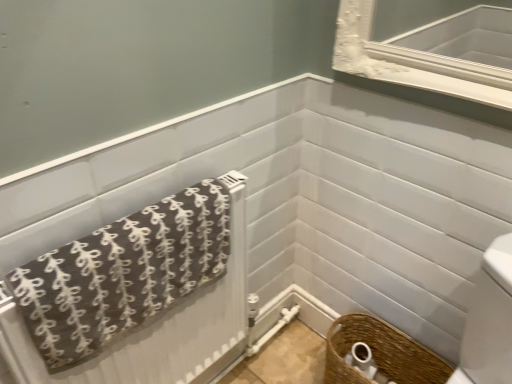
Question: Does brown fabric towel at lower left have a lesser width compared to woven brown basket at lower right?

Choices:
 (A) no
 (B) yes

Answer: (B)

Question: Does brown fabric towel at lower left appear on the right side of woven brown basket at lower right?

Choices:
 (A) yes
 (B) no

Answer: (B)

Question: Is the position of brown fabric towel at lower left less distant than that of woven brown basket at lower right?

Choices:
 (A) no
 (B) yes

Answer: (B)

Question: Considering the relative positions of brown fabric towel at lower left and woven brown basket at lower right in the image provided, is brown fabric towel at lower left to the left of woven brown basket at lower right from the viewer's perspective?

Choices:
 (A) no
 (B) yes

Answer: (B)

Question: Is brown fabric towel at lower left looking in the opposite direction of woven brown basket at lower right?

Choices:
 (A) yes
 (B) no

Answer: (B)

Question: From a real-world perspective, is brown fabric towel at lower left located beneath woven brown basket at lower right?

Choices:
 (A) yes
 (B) no

Answer: (B)

Question: From the image's perspective, would you say woven brown basket at lower right is positioned over brown fabric towel at lower left?

Choices:
 (A) yes
 (B) no

Answer: (B)

Question: From a real-world perspective, is woven brown basket at lower right positioned over brown fabric towel at lower left based on gravity?

Choices:
 (A) no
 (B) yes

Answer: (A)

Question: Is woven brown basket at lower right bigger than brown fabric towel at lower left?

Choices:
 (A) yes
 (B) no

Answer: (B)

Question: Can we say woven brown basket at lower right lies outside brown fabric towel at lower left?

Choices:
 (A) yes
 (B) no

Answer: (A)

Question: Does woven brown basket at lower right have a smaller size compared to brown fabric towel at lower left?

Choices:
 (A) yes
 (B) no

Answer: (A)

Question: Is woven brown basket at lower right thinner than brown fabric towel at lower left?

Choices:
 (A) yes
 (B) no

Answer: (A)

Question: Is woven brown basket at lower right closer to camera compared to woven brown basket at lower right?

Choices:
 (A) yes
 (B) no

Answer: (B)